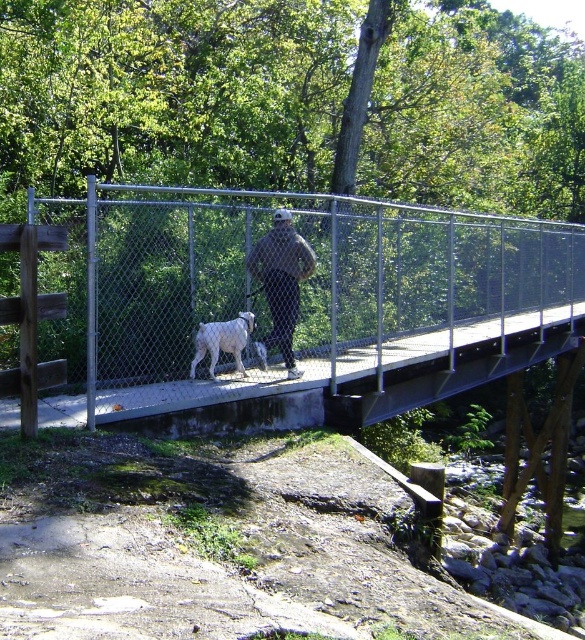
Which is in front, point (104, 220) or point (215, 348)?

Point (104, 220) is more forward.

Is silver chain-link fence at center below white fur dog at center?

Actually, silver chain-link fence at center is above white fur dog at center.

Identify the location of silver chain-link fence at center. The height and width of the screenshot is (640, 585). (305, 296).

Can you confirm if silver chain-link fence at center is bigger than dark gray fabric jacket at center?

Indeed, silver chain-link fence at center has a larger size compared to dark gray fabric jacket at center.

Is silver chain-link fence at center positioned in front of dark gray fabric jacket at center?

Yes, it is in front of dark gray fabric jacket at center.

Who is more distant from viewer, (521,220) or (311,269)?

Point (521,220)

At what (x,y) coordinates should I click in order to perform the action: click on silver chain-link fence at center. Please return your answer as a coordinate pair (x, y). The height and width of the screenshot is (640, 585). Looking at the image, I should click on (305, 296).

Who is higher up, dark gray fabric jacket at center or white fur dog at center?

dark gray fabric jacket at center is higher up.

Can you confirm if dark gray fabric jacket at center is positioned below white fur dog at center?

Actually, dark gray fabric jacket at center is above white fur dog at center.

Which is behind, point (270, 298) or point (211, 332)?

Point (270, 298)

Locate an element on the screen. This screenshot has width=585, height=640. dark gray fabric jacket at center is located at coordinates [280, 284].